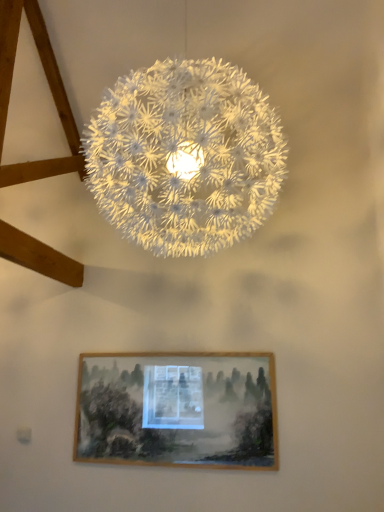
Question: Is wooden picture frame at lower center bigger than white textured sphere at center?

Choices:
 (A) yes
 (B) no

Answer: (B)

Question: Is wooden picture frame at lower center positioned behind white textured sphere at center?

Choices:
 (A) no
 (B) yes

Answer: (B)

Question: Can you confirm if wooden picture frame at lower center is taller than white textured sphere at center?

Choices:
 (A) no
 (B) yes

Answer: (A)

Question: Is wooden picture frame at lower center far away from white textured sphere at center?

Choices:
 (A) yes
 (B) no

Answer: (A)

Question: Does wooden picture frame at lower center have a smaller size compared to white textured sphere at center?

Choices:
 (A) no
 (B) yes

Answer: (B)

Question: Is wooden picture frame at lower center to the right of white textured sphere at center from the viewer's perspective?

Choices:
 (A) yes
 (B) no

Answer: (B)

Question: Is white textured sphere at center looking in the opposite direction of wooden picture frame at lower center?

Choices:
 (A) yes
 (B) no

Answer: (B)

Question: Is white textured sphere at center bigger than wooden picture frame at lower center?

Choices:
 (A) no
 (B) yes

Answer: (B)

Question: From a real-world perspective, is white textured sphere at center below wooden picture frame at lower center?

Choices:
 (A) no
 (B) yes

Answer: (A)

Question: Can you see white textured sphere at center touching wooden picture frame at lower center?

Choices:
 (A) no
 (B) yes

Answer: (A)

Question: From the image's perspective, is white textured sphere at center above wooden picture frame at lower center?

Choices:
 (A) no
 (B) yes

Answer: (B)

Question: Are white textured sphere at center and wooden picture frame at lower center far apart?

Choices:
 (A) no
 (B) yes

Answer: (B)

Question: From their relative heights in the image, would you say wooden picture frame at lower center is taller or shorter than white textured sphere at center?

Choices:
 (A) short
 (B) tall

Answer: (A)